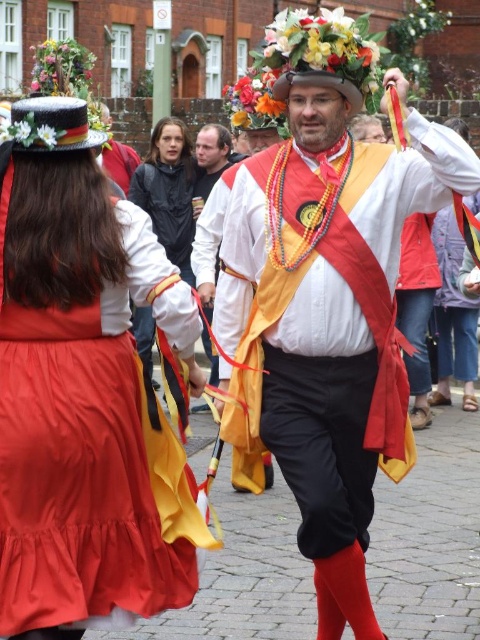
Question: Which point appears closest to the camera in this image?

Choices:
 (A) (220, 193)
 (B) (342, 307)
 (C) (180, 131)

Answer: (B)

Question: Is the position of matte white shirt at center more distant than that of matte black jacket at center?

Choices:
 (A) no
 (B) yes

Answer: (A)

Question: Is matte white shirt at center smaller than matte black hat at upper left?

Choices:
 (A) no
 (B) yes

Answer: (A)

Question: Which point is farther from the camera taking this photo?

Choices:
 (A) (99, 460)
 (B) (320, 248)

Answer: (B)

Question: Which is farther from the matte white shirt at center?

Choices:
 (A) matte black hat at upper left
 (B) matte black jacket at center

Answer: (B)

Question: From the image, what is the correct spatial relationship of matte black jacket at center in relation to matte white robe at center?

Choices:
 (A) above
 (B) below

Answer: (B)